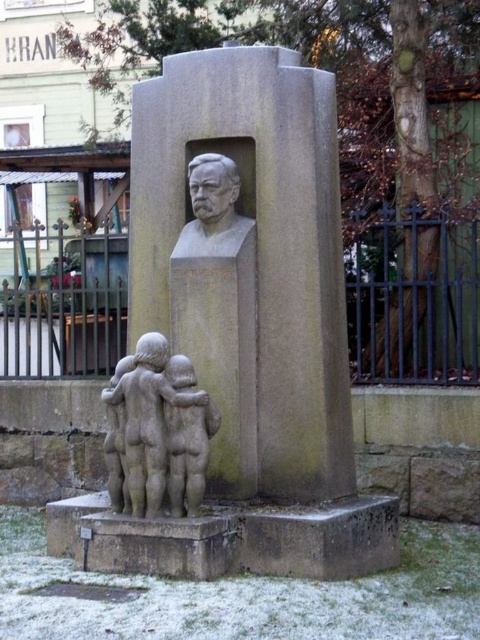
Question: Is gray stone monument at center bigger than matte gray bust at center?

Choices:
 (A) yes
 (B) no

Answer: (A)

Question: Can you confirm if gray stone children at lower left is smaller than matte gray bust at center?

Choices:
 (A) yes
 (B) no

Answer: (B)

Question: Which point is farther to the camera?

Choices:
 (A) (160, 353)
 (B) (195, 298)
 (C) (211, 227)

Answer: (C)

Question: Does gray stone children at lower left come in front of matte gray bust at center?

Choices:
 (A) no
 (B) yes

Answer: (B)

Question: Which point is farther to the camera?

Choices:
 (A) matte gray bust at center
 (B) gray stone children at lower left
 (C) gray stone monument at center

Answer: (A)

Question: Which point is closer to the camera taking this photo?

Choices:
 (A) (211, 365)
 (B) (170, 369)

Answer: (B)